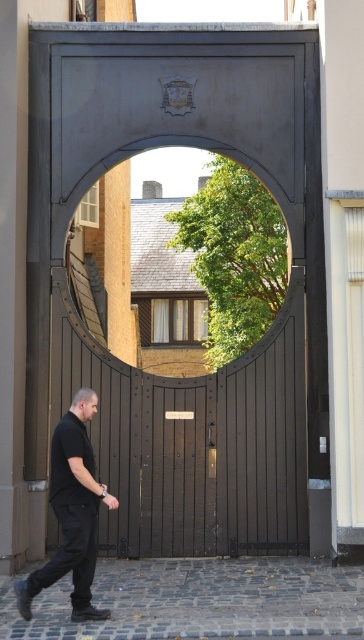
Question: Can you confirm if dark brown wooden gate at center is positioned below brown cobblestone alley at lower center?

Choices:
 (A) no
 (B) yes

Answer: (A)

Question: Can you confirm if dark brown wooden gate at center is positioned below black matte pants at lower left?

Choices:
 (A) no
 (B) yes

Answer: (A)

Question: Considering the real-world distances, which object is farthest from the black matte pants at lower left?

Choices:
 (A) brown cobblestone alley at lower center
 (B) dark brown wooden gate at center

Answer: (B)

Question: Which point is closer to the camera?

Choices:
 (A) black matte pants at lower left
 (B) dark brown wooden gate at center

Answer: (A)

Question: Is dark brown wooden gate at center to the right of brown cobblestone alley at lower center from the viewer's perspective?

Choices:
 (A) no
 (B) yes

Answer: (A)

Question: Which object is the farthest from the dark brown wooden gate at center?

Choices:
 (A) black matte pants at lower left
 (B) brown cobblestone alley at lower center

Answer: (A)